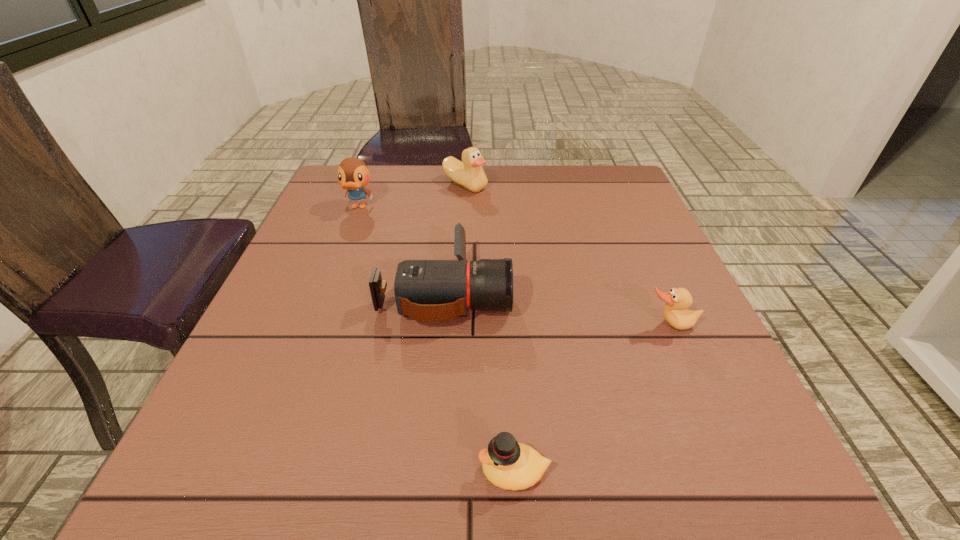
Find the location of `vacant space located 0.180m on the beak of the rightmost object`. vacant space located 0.180m on the beak of the rightmost object is located at coordinates (712, 420).

At what (x,y) coordinates should I click in order to perform the action: click on free location located on the front-facing side of the nearest duck. Please return your answer as a coordinate pair (x, y). Looking at the image, I should click on (249, 471).

Find the location of a particular element. vacant space situated 0.150m on the front-facing side of the nearest duck is located at coordinates (373, 471).

Find the location of a particular element. This screenshot has height=540, width=960. free space located 0.360m on the front-facing side of the nearest duck is located at coordinates tap(228, 471).

Locate an element on the screen. The height and width of the screenshot is (540, 960). object situated at the near edge is located at coordinates (507, 464).

The image size is (960, 540). In order to click on object at the left edge in this screenshot , I will do `click(353, 175)`.

Where is `object present at the right edge`? object present at the right edge is located at coordinates (675, 312).

Locate an element on the screen. The width and height of the screenshot is (960, 540). object that is positioned at the far left corner is located at coordinates (353, 175).

This screenshot has height=540, width=960. In the image, there is a desktop. What are the coordinates of `vacant space at the far edge` in the screenshot? It's located at (525, 167).

Identify the location of free space at the left edge of the desktop. (357, 226).